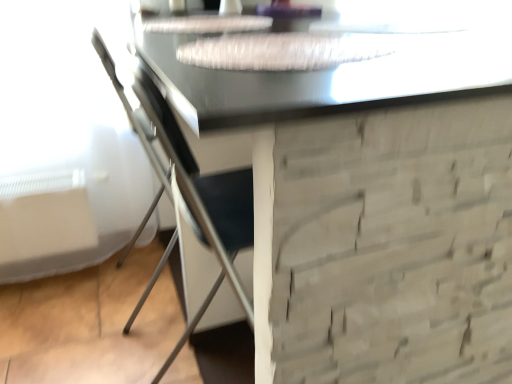
This screenshot has width=512, height=384. Find the location of `vacant region in front of metallic silver swivel chair at center`. vacant region in front of metallic silver swivel chair at center is located at coordinates (122, 352).